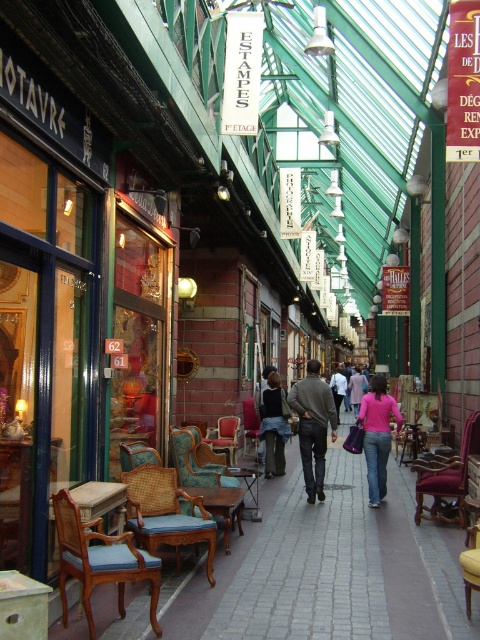
Is dark brown leather jacket at center below wooden armchair at center?

Actually, dark brown leather jacket at center is above wooden armchair at center.

I want to click on dark brown leather jacket at center, so click(x=274, y=426).

Is point (280, 435) farther from camera compared to point (223, 435)?

No, (280, 435) is in front of (223, 435).

Find the location of a particular element. Image resolution: width=480 pixels, height=640 pixels. dark brown leather jacket at center is located at coordinates (274, 426).

Can you confirm if dark brown leather jacket at center is shorter than pink fabric jacket at center?

In fact, dark brown leather jacket at center may be taller than pink fabric jacket at center.

Is dark brown leather jacket at center to the right of pink fabric jacket at center from the viewer's perspective?

In fact, dark brown leather jacket at center is to the left of pink fabric jacket at center.

Identify the location of dark brown leather jacket at center. (274, 426).

Locate an element on the screen. This screenshot has width=480, height=640. dark brown leather jacket at center is located at coordinates (274, 426).

Can you confirm if teal fabric armchair at center is wider than light brown leather jacket at center?

No.

Who is shorter, teal fabric armchair at center or light brown leather jacket at center?

With less height is teal fabric armchair at center.

The width and height of the screenshot is (480, 640). Find the location of `teal fabric armchair at center`. teal fabric armchair at center is located at coordinates (252, 428).

This screenshot has height=640, width=480. In order to click on teal fabric armchair at center in this screenshot , I will do `click(252, 428)`.